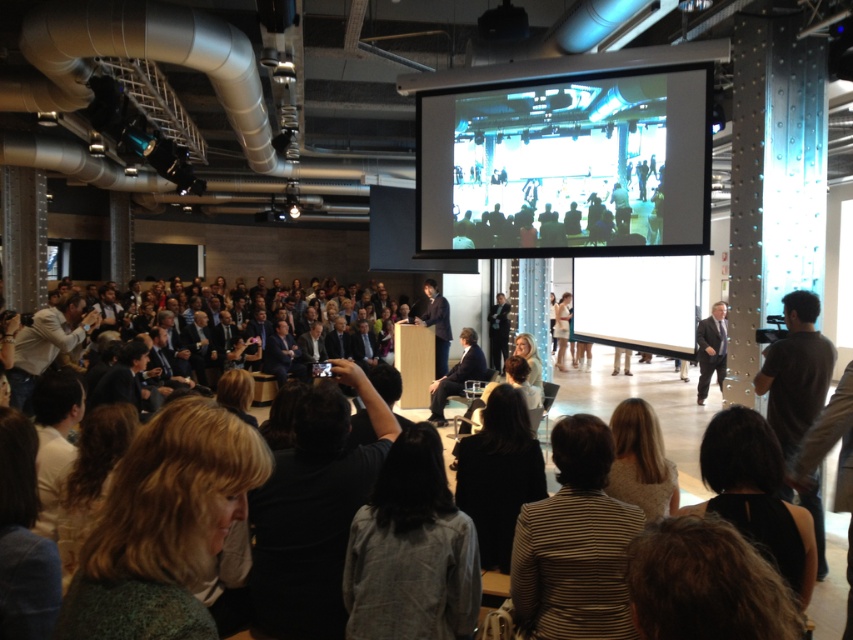
You are an event organizer in the back of the room. You need to retrieve both the striped fabric jacket at center and the light brown leather jacket at left. The hallway outside is 10 feet wide. Can you carry both jackets through the hallway at the same time?

The striped fabric jacket at center and light brown leather jacket at left are 15.83 feet apart. Since the hallway is only 10 feet wide, you cannot carry both jackets through the hallway at the same time because their combined width exceeds the hallway width.

You are standing at the back of the conference hall and want to take a photo of both the person at the podium and the individual walking away. Given the positions of point 1 at coordinates point [631,276] and point 2 at coordinates point [24,372], which point is closer to your camera to ensure both subjects are in focus?

Point 1 at coordinates point [631,276] is further to the camera than point 2 at coordinates point [24,372]. To ensure both subjects are in focus, you should focus on the closer point, which is point 2 at coordinates point [24,372].

You are organizing a presentation and need to ensure that the light brown leather jacket at left does not block the white matte projection screen at center during the talk. Based on their sizes, is there a risk that the jacket could cover part of the screen?

The white matte projection screen at center might be wider than light brown leather jacket at left, so there is a possibility that the jacket could cover part of the screen if positioned too close. Ensure proper placement to avoid obstruction.